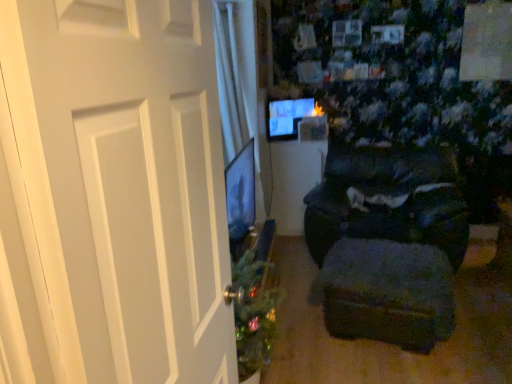
This screenshot has height=384, width=512. What are the coordinates of `vacant area that is situated to the right of dark fabric ottoman at lower right` in the screenshot? It's located at (482, 317).